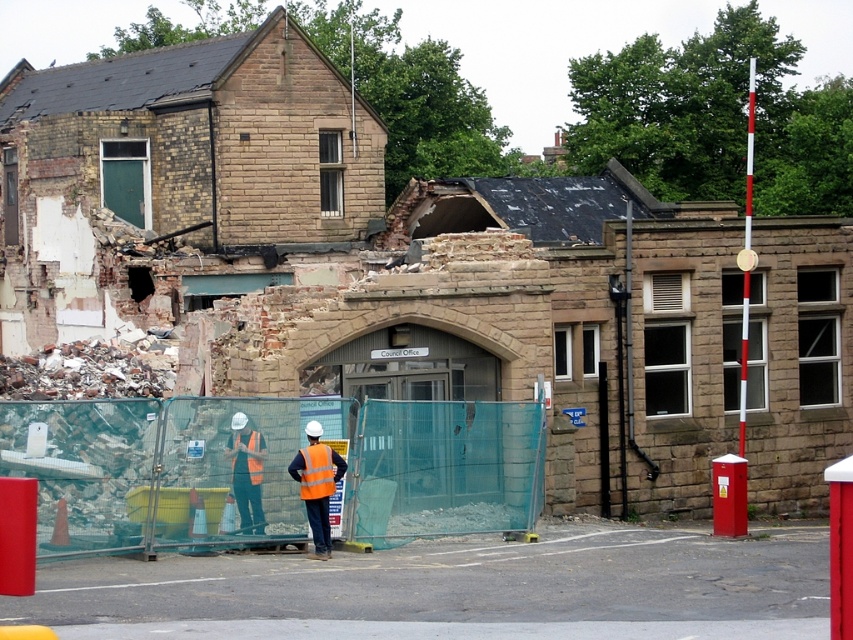
Does point (241, 497) lie in front of point (312, 454)?

That is False.

Is orange reflective vest at center shorter than hi-visibility fabric safety vest at center?

Incorrect, orange reflective vest at center's height does not fall short of hi-visibility fabric safety vest at center's.

Image resolution: width=853 pixels, height=640 pixels. What are the coordinates of `orange reflective vest at center` in the screenshot? It's located at (247, 472).

Is hi-visibility fabric safety vest at center further to camera compared to orange reflective safety vest at center?

No, hi-visibility fabric safety vest at center is in front of orange reflective safety vest at center.

Is point (315, 486) farther from viewer compared to point (248, 472)?

No, it is not.

Who is more forward, [323,461] or [254,477]?

Point [323,461] is more forward.

Image resolution: width=853 pixels, height=640 pixels. What are the coordinates of `hi-visibility fabric safety vest at center` in the screenshot? It's located at (316, 472).

Can you confirm if high visibility vest at center is shorter than hi-visibility fabric safety vest at center?

In fact, high visibility vest at center may be taller than hi-visibility fabric safety vest at center.

Who is higher up, high visibility vest at center or hi-visibility fabric safety vest at center?

hi-visibility fabric safety vest at center

Measure the distance between point (x=312, y=458) and camera.

A distance of 26.00 meters exists between point (x=312, y=458) and camera.

You are a GUI agent. You are given a task and a screenshot of the screen. Output one action in this format:
    pyautogui.click(x=<x>, y=<y>)
    Task: Click on the high visibility vest at center
    
    Given the screenshot: What is the action you would take?
    pyautogui.click(x=317, y=484)